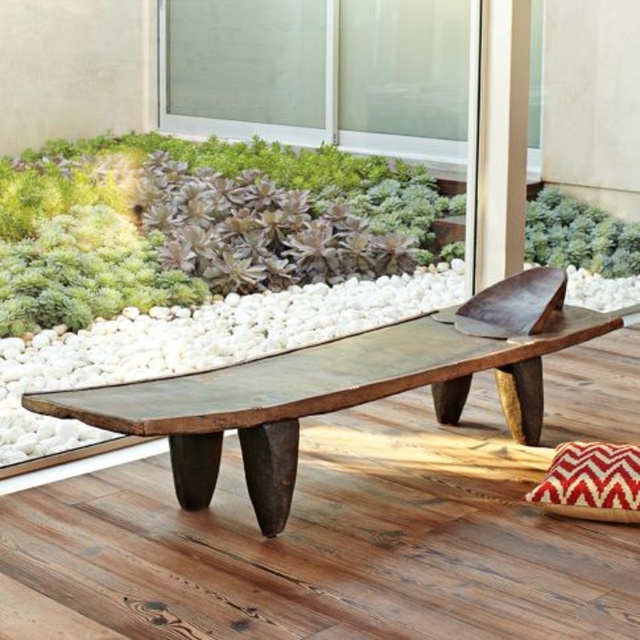
Question: Which object is farther from the camera taking this photo?

Choices:
 (A) green leafy plant at center
 (B) rustic wood bench at center

Answer: (A)

Question: Can you confirm if rustic wood bench at center is thinner than green leafy plant at center?

Choices:
 (A) yes
 (B) no

Answer: (B)

Question: Does rustic wood bench at center have a greater width compared to green leafy plant at center?

Choices:
 (A) yes
 (B) no

Answer: (A)

Question: Which object appears farthest from the camera in this image?

Choices:
 (A) rustic wood bench at center
 (B) green leafy plant at center

Answer: (B)

Question: Is rustic wood bench at center wider than green leafy plant at center?

Choices:
 (A) yes
 (B) no

Answer: (A)

Question: Which object is farther from the camera taking this photo?

Choices:
 (A) green leafy plant at center
 (B) rustic wood bench at center

Answer: (A)